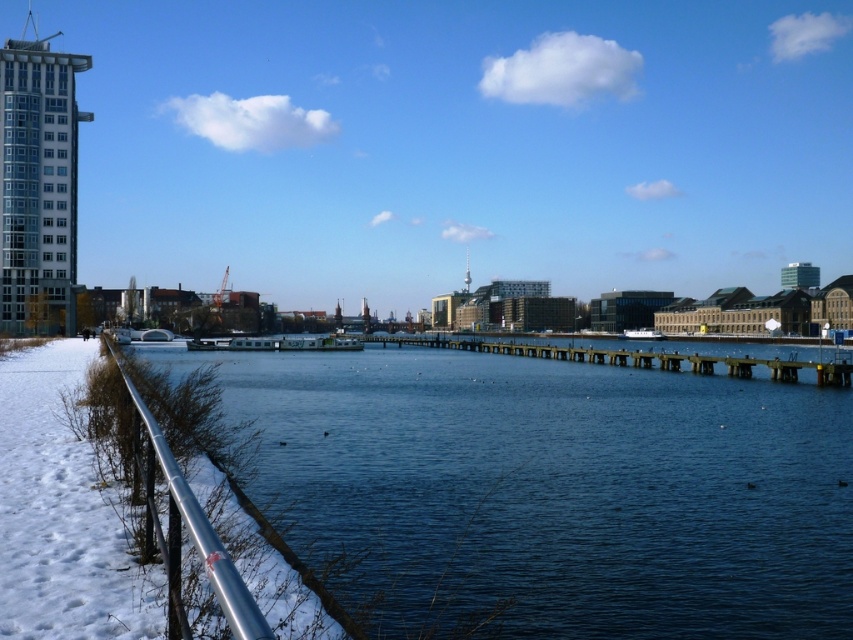
Question: Does glassy reflective skyscraper at upper left have a greater width compared to silver metallic rail at left?

Choices:
 (A) yes
 (B) no

Answer: (A)

Question: Which object is positioned farthest from the blue water at center?

Choices:
 (A) wooden at center
 (B) silver metallic rail at left

Answer: (A)

Question: Can you confirm if blue water at center is bigger than silver metallic rail at left?

Choices:
 (A) yes
 (B) no

Answer: (A)

Question: Among these objects, which one is nearest to the camera?

Choices:
 (A) wooden at center
 (B) blue water at center
 (C) glassy reflective skyscraper at upper left
 (D) silver metallic rail at left

Answer: (D)

Question: Among these objects, which one is farthest from the camera?

Choices:
 (A) silver metallic rail at left
 (B) blue water at center
 (C) glassy reflective skyscraper at upper left

Answer: (C)

Question: Is glassy reflective skyscraper at upper left above silver metallic rail at left?

Choices:
 (A) no
 (B) yes

Answer: (B)